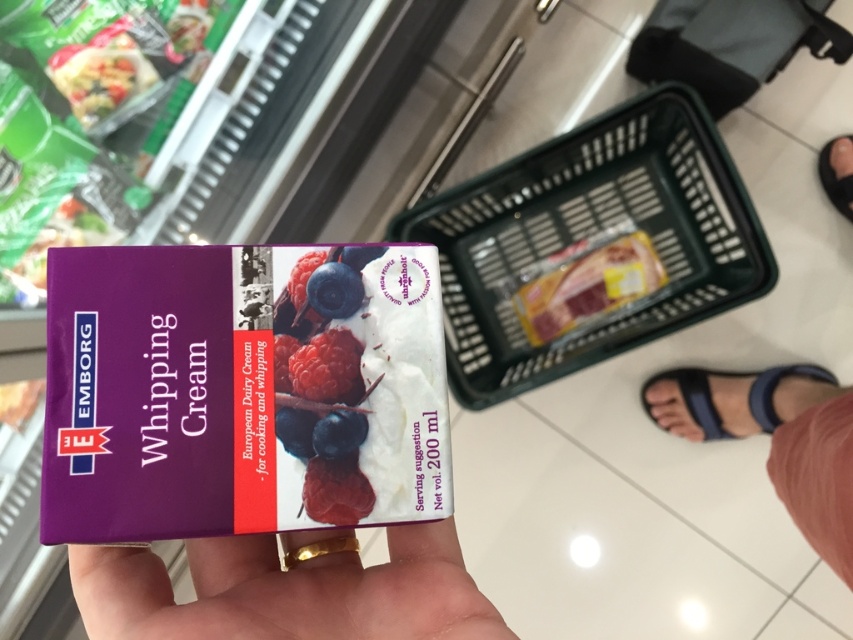
Based on the photo, you are a grocery store employee who just noticed the green plastic shopping basket at center and the black rubber sandal at lower right. Which object is closer to the floor?

The black rubber sandal at lower right is closer to the floor because the green plastic shopping basket at center is positioned under it.

You are a customer in a grocery store holding the Emborg Whipping Cream carton. You want to place it into the green plastic shopping basket at center and the black rubber sandal at lower right. Which one can you place the carton into?

The green plastic shopping basket at center can hold the carton, while the black rubber sandal at lower right is not designed for holding items. Therefore, you should place the carton into the green plastic shopping basket at center.

You are a customer in a grocery store holding the Emborg Whipping Cream carton. You need to place it back on the shelf and also pick up the blueberry matte at center and the blue fabric sandal at lower right. Based on their positions, which item should you pick up first to follow the leftmost to rightmost order?

You should pick up the blueberry matte at center first because it is positioned to the left of the blue fabric sandal at lower right.